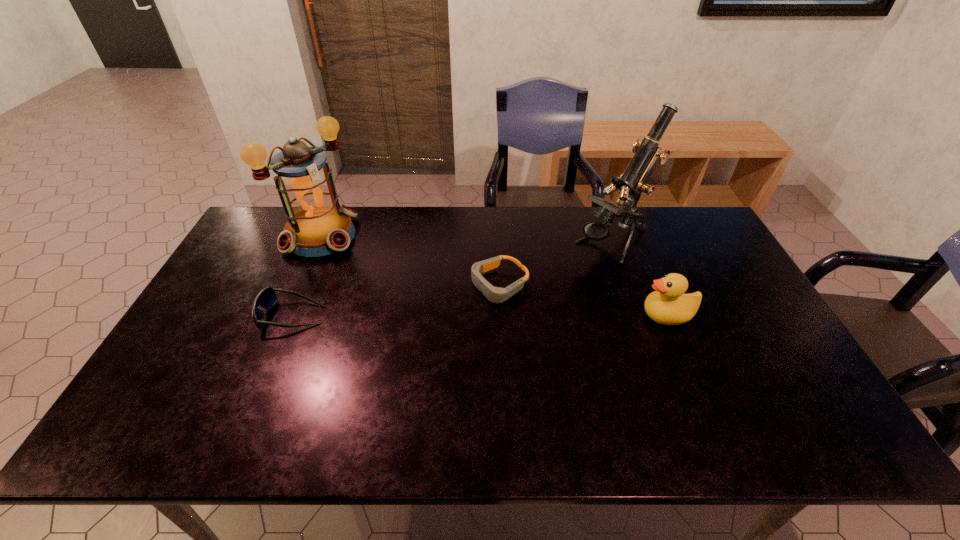
Find the location of a particular element. The image size is (960, 540). free space on the desktop that is between the fourth tallest object and the duck and is positioned through the eyepiece of the microscope is located at coordinates (503, 315).

Find the location of a particular element. vacant space on the desktop that is between the fourth tallest object and the third shortest object and is positioned on the front-facing side of the lantern is located at coordinates (428, 315).

The image size is (960, 540). What are the coordinates of `free spot on the desktop that is between the sunglasses and the third shortest object and is positioned on the front and back of the goggles` in the screenshot? It's located at (436, 315).